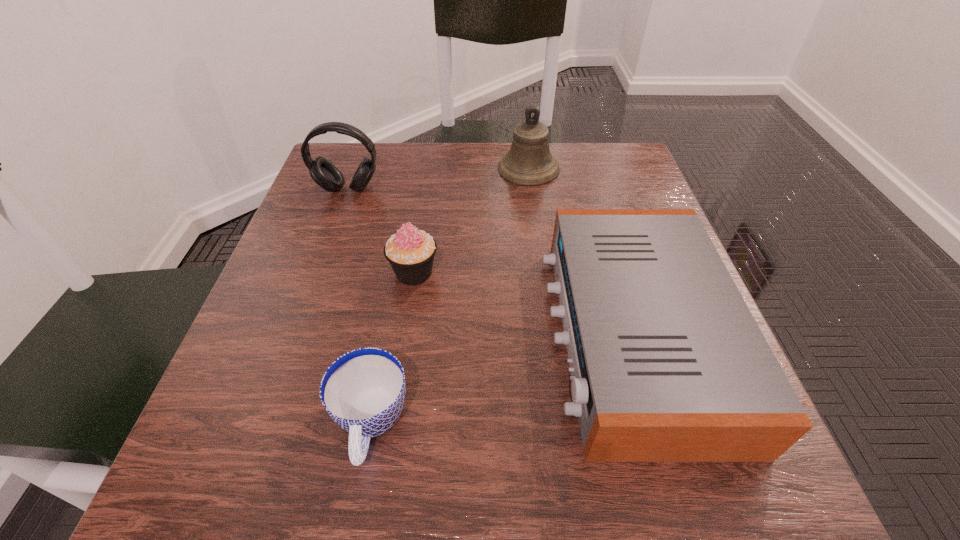
Locate an element on the screen. empty location between the shortest object and the leftmost object is located at coordinates (360, 307).

Identify the location of free area in between the bell and the headset. Image resolution: width=960 pixels, height=540 pixels. (439, 179).

You are a GUI agent. You are given a task and a screenshot of the screen. Output one action in this format:
    pyautogui.click(x=<x>, y=<y>)
    Task: Click on the free spot between the cup and the bell
    The height and width of the screenshot is (540, 960).
    Given the screenshot: What is the action you would take?
    point(450,297)

At what (x,y) coordinates should I click in order to perform the action: click on object that can be found as the second closest to the cupcake. Please return your answer as a coordinate pair (x, y). This screenshot has width=960, height=540. Looking at the image, I should click on (668, 364).

Choose which object is the second nearest neighbor to the cupcake. Please provide its 2D coordinates. Your answer should be formatted as a tuple, i.e. [(x, y)], where the tuple contains the x and y coordinates of a point satisfying the conditions above.

[(668, 364)]

Image resolution: width=960 pixels, height=540 pixels. In order to click on free space that satisfies the following two spatial constraints: 1. on the earcups of the cupcake; 2. on the left side of the headset in this screenshot , I will do `click(318, 272)`.